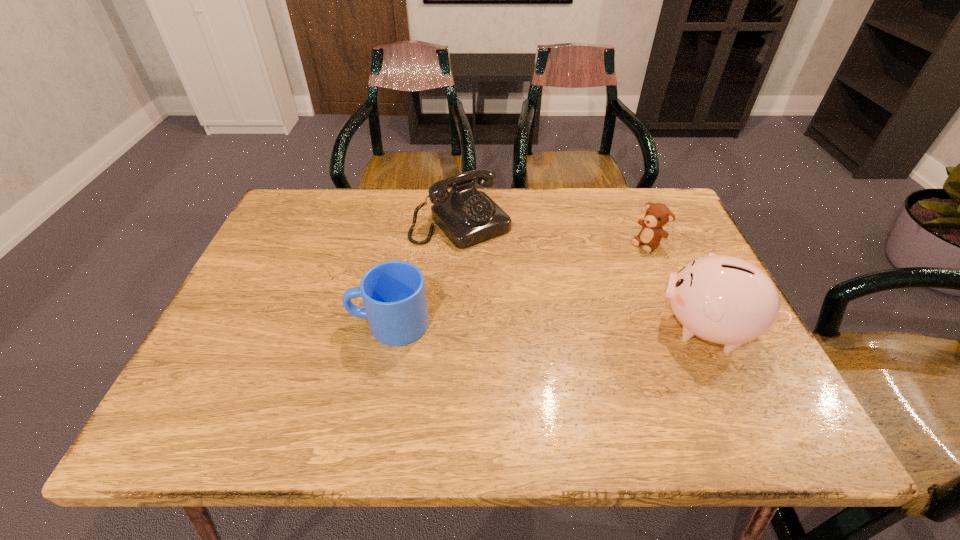
In order to click on mug in this screenshot , I will do `click(393, 292)`.

This screenshot has height=540, width=960. What are the coordinates of `piggy bank` in the screenshot? It's located at (723, 299).

This screenshot has width=960, height=540. I want to click on telephone, so [467, 217].

At what (x,y) coordinates should I click in order to perform the action: click on teddy bear. Please return your answer as a coordinate pair (x, y). Looking at the image, I should click on (657, 215).

Locate an element on the screen. The width and height of the screenshot is (960, 540). free space located on the side of the mug with the handle is located at coordinates (238, 323).

At what (x,y) coordinates should I click in order to perform the action: click on blank space located 0.060m on the side of the mug with the handle. Please return your answer as a coordinate pair (x, y). Image resolution: width=960 pixels, height=540 pixels. Looking at the image, I should click on (323, 323).

Where is `free region located 0.210m on the side of the mug with the handle`? This screenshot has height=540, width=960. free region located 0.210m on the side of the mug with the handle is located at coordinates (255, 323).

The width and height of the screenshot is (960, 540). I want to click on vacant space located 0.400m on the back of the piggy bank, so click(x=647, y=201).

Where is `free region located on the dial of the telephone`? free region located on the dial of the telephone is located at coordinates (516, 279).

Locate an element on the screen. Image resolution: width=960 pixels, height=540 pixels. vacant space located on the dial of the telephone is located at coordinates (530, 294).